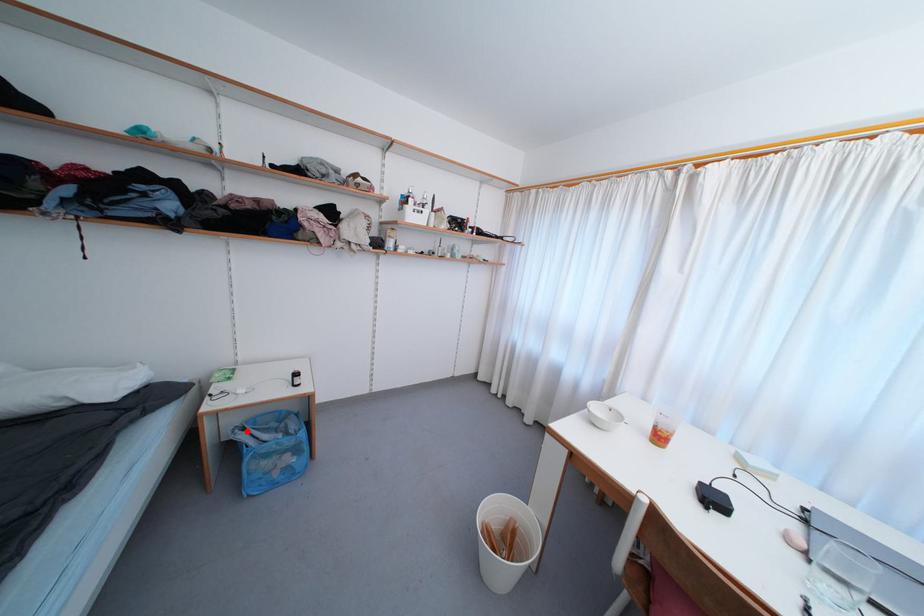
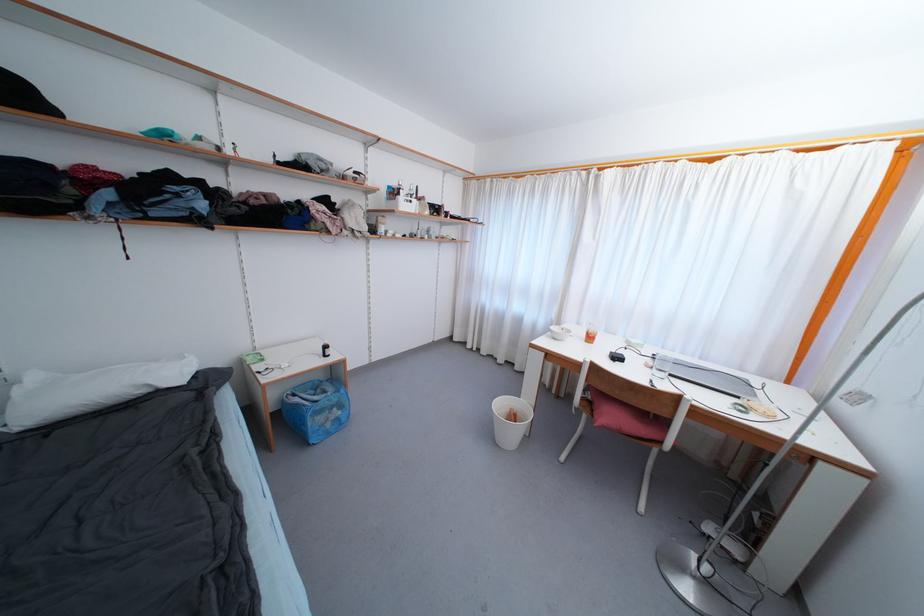
In the second image, find the point that corresponds to the highlighted location in the first image.

(298, 398)